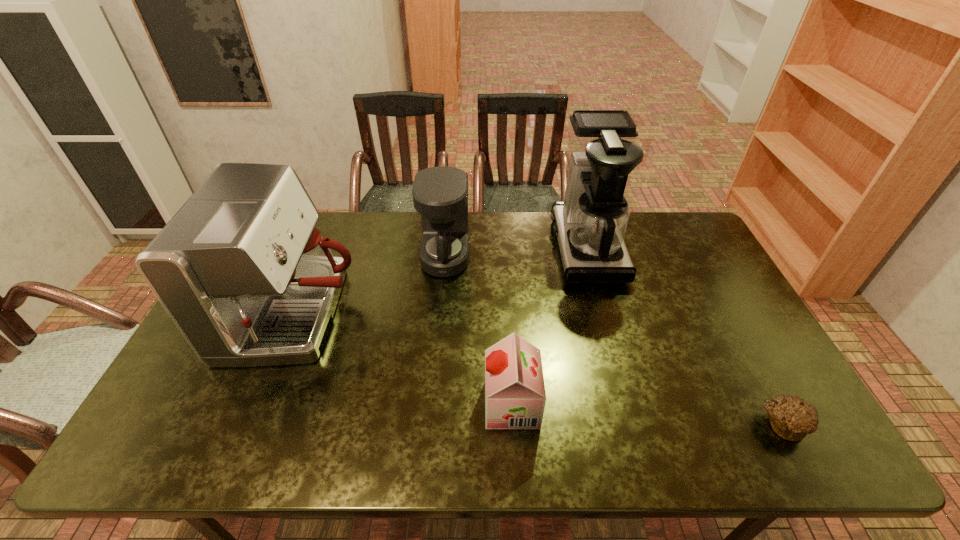
Locate which coffee maker ranks second in proximity to the leftmost object. Please provide its 2D coordinates. Your answer should be formatted as a tuple, i.e. [(x, y)], where the tuple contains the x and y coordinates of a point satisfying the conditions above.

[(590, 224)]

In order to click on vacant space that satisfies the following two spatial constraints: 1. at the front of the rightmost coffee maker where the controls are located; 2. on the left side of the rightmost object in this screenshot , I will do `click(636, 424)`.

I want to click on free spot that satisfies the following two spatial constraints: 1. on the button side of the rightmost object; 2. on the left side of the fourth object from right to left, so click(x=431, y=424).

In order to click on free region that satisfies the following two spatial constraints: 1. on the back side of the muffin; 2. at the front of the fourth object from left to right where the controls are located in this screenshot , I will do `click(687, 247)`.

I want to click on free space that satisfies the following two spatial constraints: 1. with the cap open on the fourth tallest object; 2. on the right side of the shortest object, so point(513,424).

Find the location of a particular element. free location that satisfies the following two spatial constraints: 1. on the back side of the muffin; 2. with the cap open on the soya milk is located at coordinates (773, 404).

Identify the location of vacant area in the image that satisfies the following two spatial constraints: 1. on the front of the muffin near the spout; 2. on the left side of the leftmost coffee maker. (252, 424).

At what (x,y) coordinates should I click in order to perform the action: click on vacant area that satisfies the following two spatial constraints: 1. with the cap open on the rightmost object; 2. on the right side of the soya milk. Please return your answer as a coordinate pair (x, y). Looking at the image, I should click on (513, 424).

What are the coordinates of `vacant point that satisfies the following two spatial constraints: 1. at the front of the rightmost coffee maker where the controls are located; 2. on the back side of the shortest object` in the screenshot? It's located at (636, 424).

This screenshot has width=960, height=540. In order to click on blank space that satisfies the following two spatial constraints: 1. with the cap open on the soya milk; 2. on the left side of the muffin in this screenshot , I will do `click(513, 424)`.